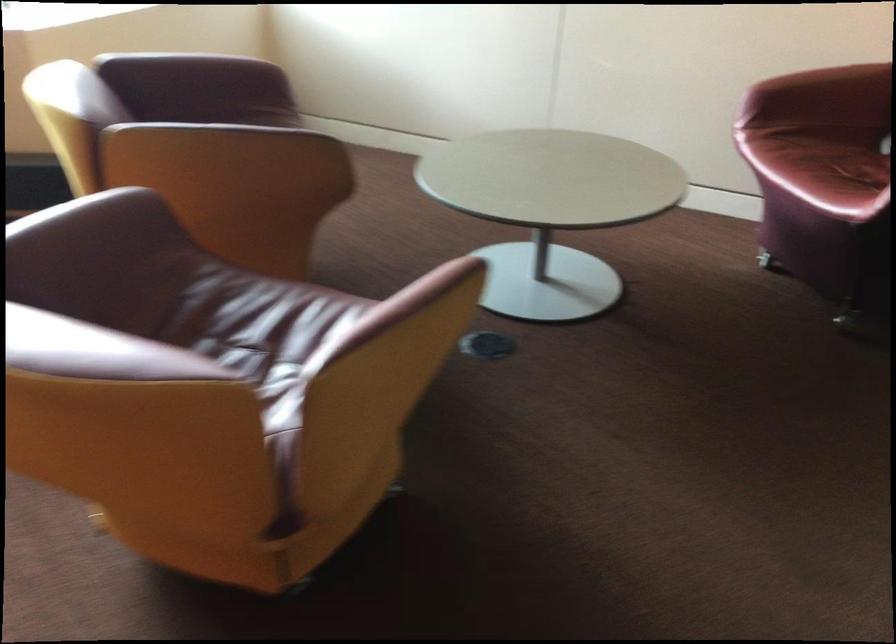
Locate an element on the screen. The height and width of the screenshot is (644, 896). brown chair sitting surface is located at coordinates [250, 323].